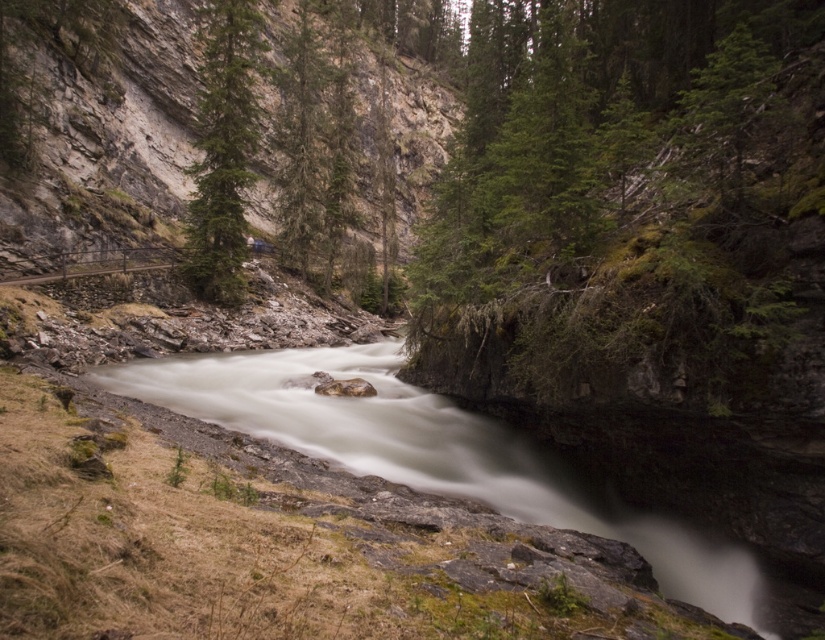
You are standing at the point marked as point (224, 148) in the image. What object is located exactly at that coordinate?

The green matte tree at upper center is located exactly at point (224, 148).

You are standing at the wooden bridge on the left side of the river and want to look at the green trees in the scene. Which of the two trees, the green matte tree at upper center or the green textured tree at center, is positioned higher up in the image?

The green textured tree at center is positioned higher up in the image because the green matte tree at upper center is below it.

You are a hiker standing at the wooden bridge on the left side of the river. Looking towards the center of the image, which tree is closer to you, the green matte tree at upper center or the green textured tree at center?

The green textured tree at center is closer to you because the green matte tree at upper center is to the left of it, indicating it is positioned further back in the scene.